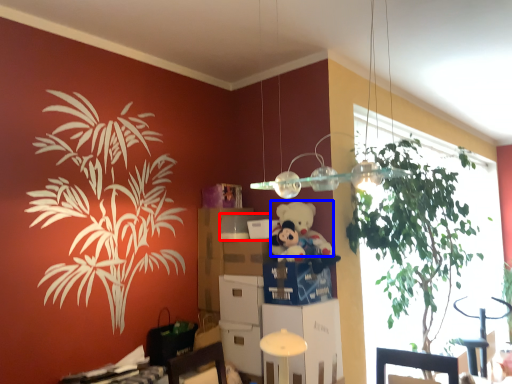
Question: Which point is further to the camera, box (highlighted by a red box) or teddy (highlighted by a blue box)?

Choices:
 (A) box
 (B) teddy

Answer: (A)